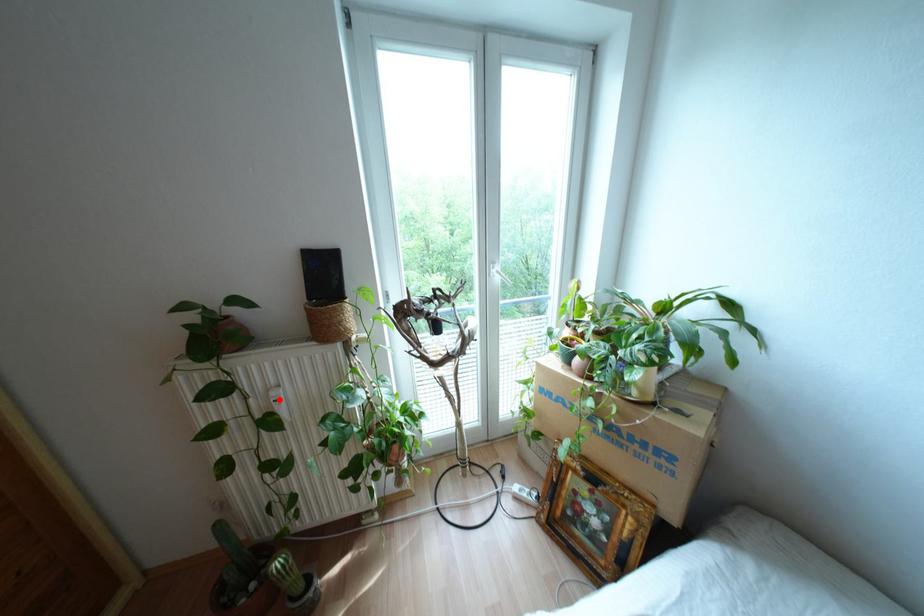
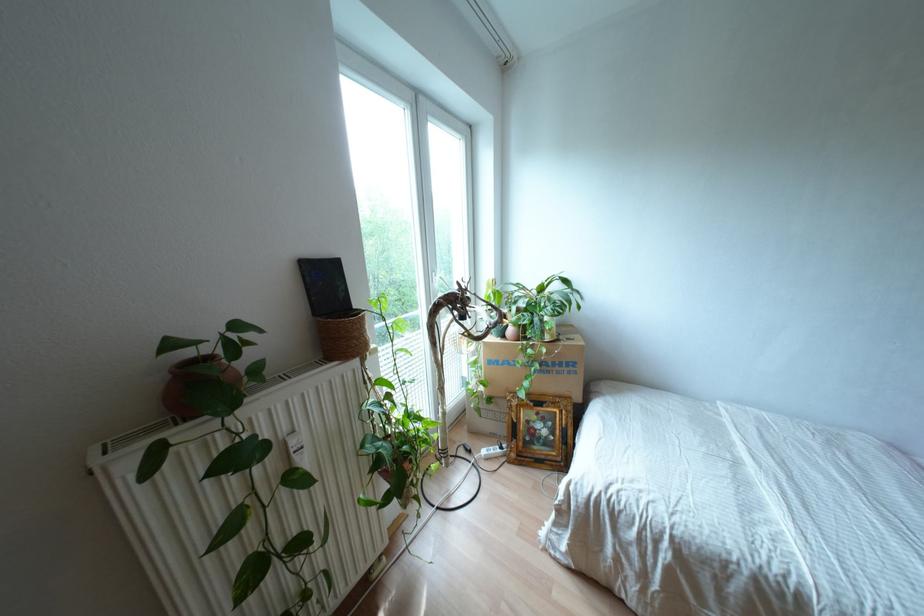
The point at the highlighted location is marked in the first image. Where is the corresponding point in the second image?

(301, 448)